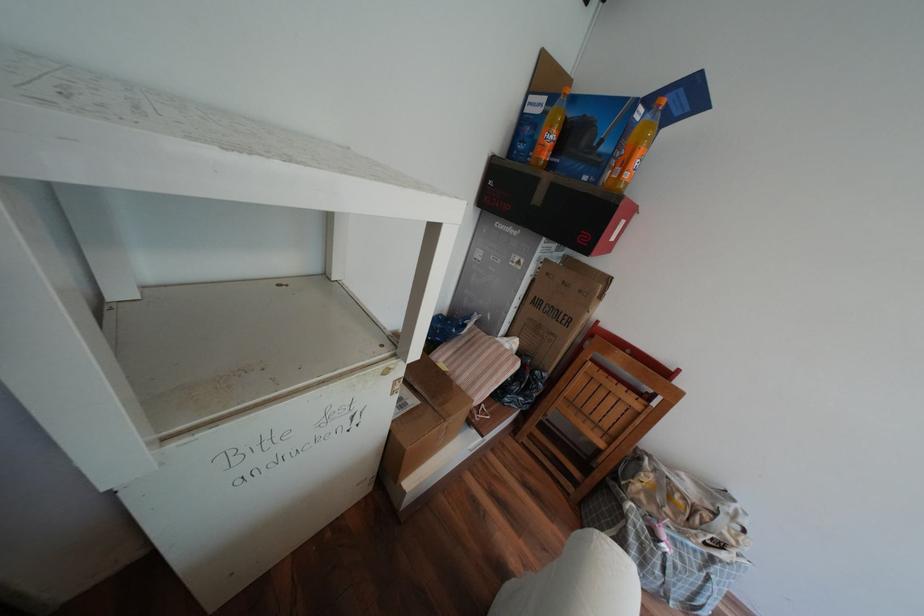
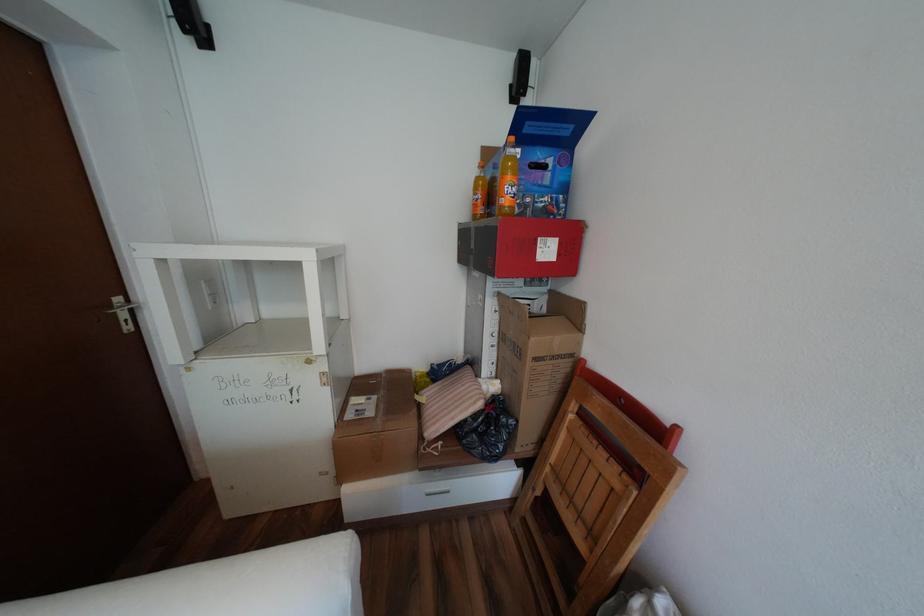
Locate, in the second image, the point that corresponds to pixel 531 297 in the first image.

(505, 334)